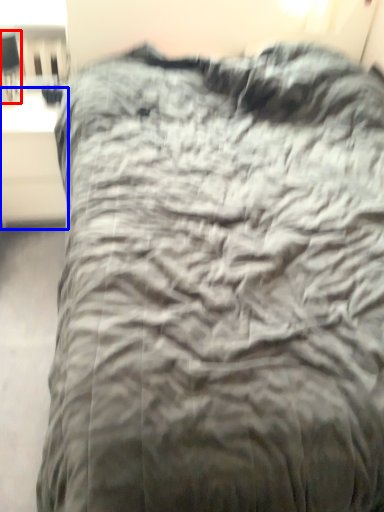
Question: Among these objects, which one is nearest to the camera, table lamp (highlighted by a red box) or table (highlighted by a blue box)?

Choices:
 (A) table lamp
 (B) table

Answer: (A)